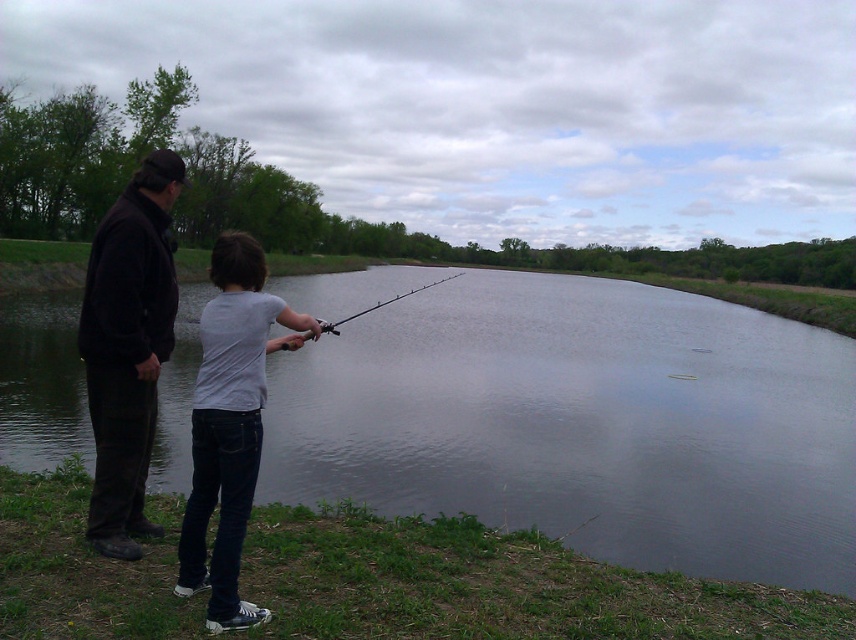
Is white matte shirt at center bigger than smooth black rod at center?

No.

Which is in front, point (248, 442) or point (424, 285)?

Positioned in front is point (248, 442).

Where is `white matte shirt at center`? Image resolution: width=856 pixels, height=640 pixels. white matte shirt at center is located at coordinates (230, 422).

Is dark brown leather jacket at left behind white matte shirt at center?

Yes, dark brown leather jacket at left is behind white matte shirt at center.

Between point (150, 214) and point (188, 531), which one is positioned behind?

Point (150, 214)

You are a GUI agent. You are given a task and a screenshot of the screen. Output one action in this format:
    pyautogui.click(x=<x>, y=<y>)
    Task: Click on the dark brown leather jacket at left
    
    Given the screenshot: What is the action you would take?
    pyautogui.click(x=128, y=348)

Does clear water at center appear over smooth black rod at center?

No.

Does clear water at center come behind smooth black rod at center?

No, clear water at center is in front of smooth black rod at center.

Is point (828, 490) closer to camera compared to point (388, 301)?

Yes, point (828, 490) is closer to viewer.

Where is `clear water at center`? Image resolution: width=856 pixels, height=640 pixels. clear water at center is located at coordinates (584, 422).